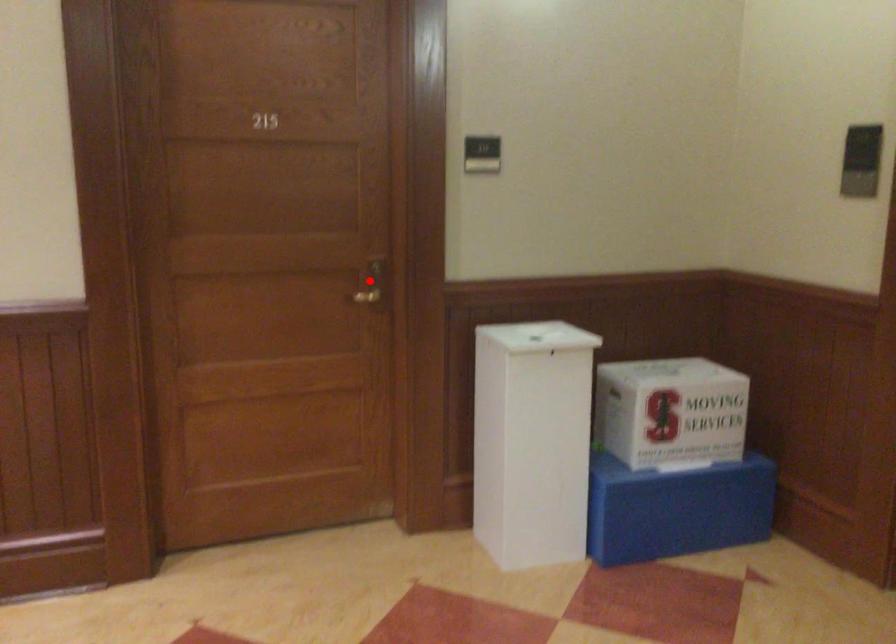
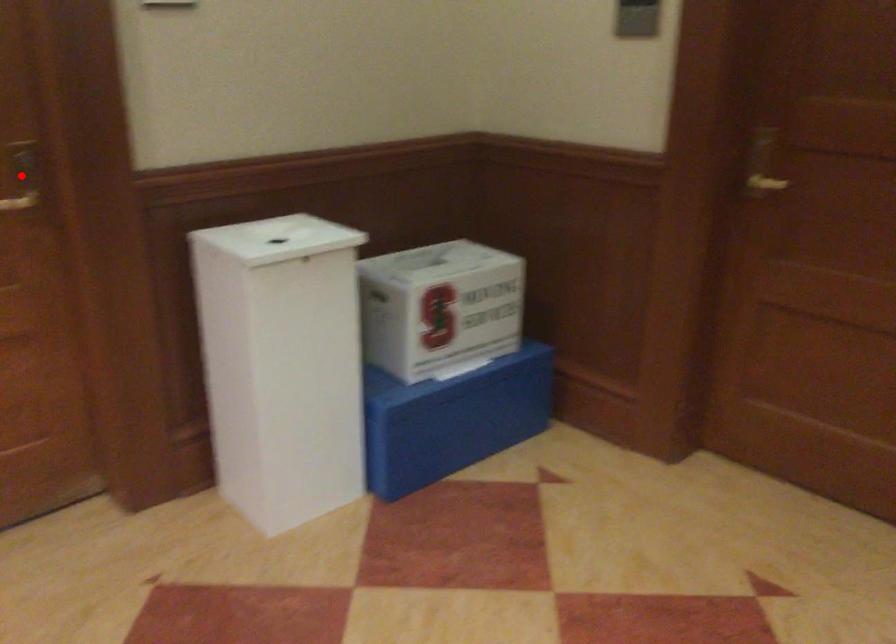
I am providing you with two images of the same scene from different viewpoints. A red point is marked on the first image and another point is marked on the second image. Do the highlighted points in image1 and image2 indicate the same real-world spot?

Yes